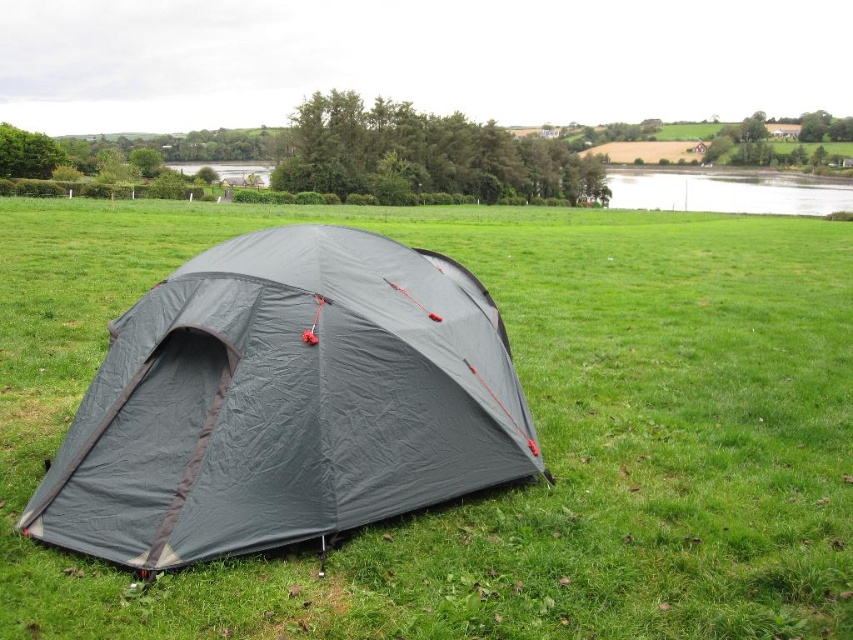
From the picture: You are standing at the origin point of the coordinate system where the grassy field is your reference. The dark gray fabric tent at center is located at coordinate point 0.628 on the x axis and 0.335 on the y axis. If you want to walk directly towards the tent, which direction should you move in terms of x and y coordinates?

To walk directly towards the dark gray fabric tent at center located at coordinates x 0.628 and y 0.335, you should move in the positive x and positive y direction since both coordinates are greater than zero.

You are standing at the point marked by the coordinates point [285,401] in the image. What object are you directly above?

The point [285,401] corresponds to the dark gray fabric tent at center, so you are directly above the dark gray fabric tent at center.